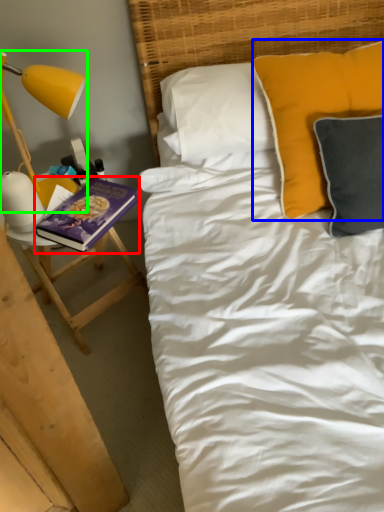
Question: Estimate the real-world distances between objects in this image. Which object is farther from paperback book (highlighted by a red box), pillow (highlighted by a blue box) or lamp (highlighted by a green box)?

Choices:
 (A) pillow
 (B) lamp

Answer: (A)